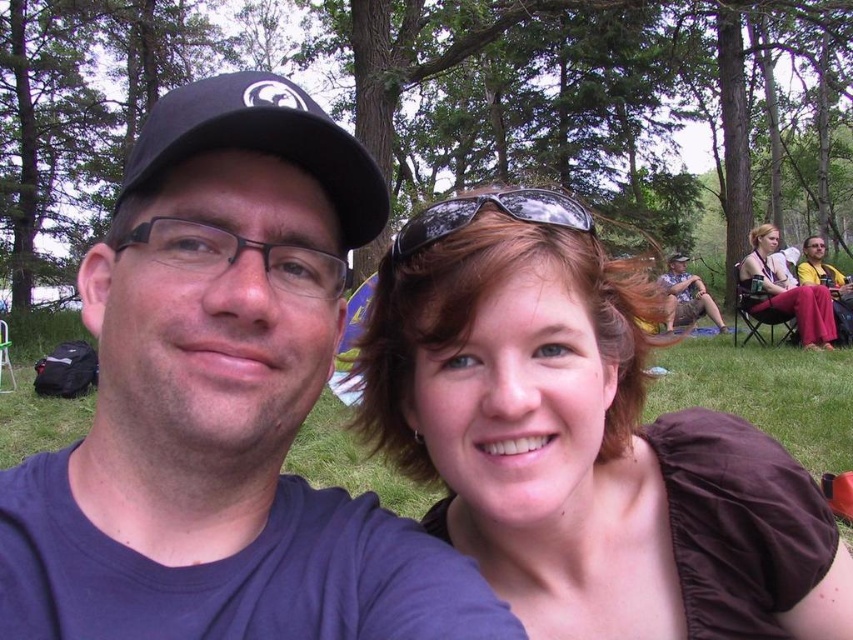
Question: Is black reflective sunglasses at center to the left of camouflage fabric shirt at center from the viewer's perspective?

Choices:
 (A) yes
 (B) no

Answer: (A)

Question: Does matte black cap at upper left come behind brown leather jacket at upper right?

Choices:
 (A) no
 (B) yes

Answer: (A)

Question: Does black reflective sunglasses at center appear under matte yellow dress at center?

Choices:
 (A) no
 (B) yes

Answer: (B)

Question: Among these objects, which one is farthest from the camera?

Choices:
 (A) camouflage fabric shirt at center
 (B) black matte baseball cap at upper left
 (C) brown fabric shirt at center

Answer: (A)

Question: Which object is closer to the camera taking this photo?

Choices:
 (A) black reflective sunglasses at center
 (B) black matte baseball cap at upper left

Answer: (B)

Question: Estimate the real-world distances between objects in this image. Which object is farther from the brown fabric shirt at center?

Choices:
 (A) black reflective sunglasses at center
 (B) matte black cap at upper left
 (C) camouflage fabric shirt at center
 (D) matte yellow dress at center

Answer: (C)